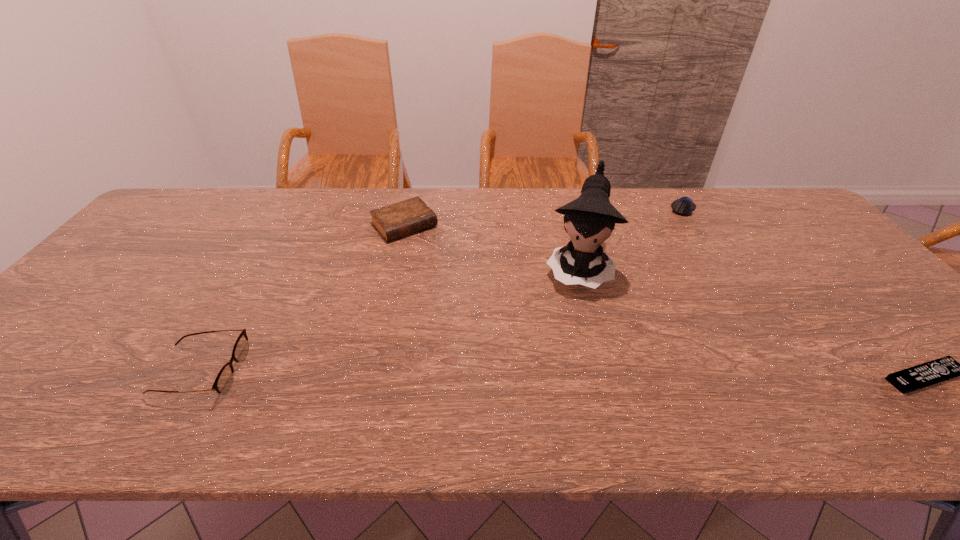
Where is `object that ranks as the third closest to the diary`? The image size is (960, 540). object that ranks as the third closest to the diary is located at coordinates (684, 206).

The image size is (960, 540). What are the coordinates of `free spot that satisfies the following two spatial constraints: 1. on the back side of the second object from right to left; 2. on the right side of the third shortest object` in the screenshot? It's located at (408, 208).

The height and width of the screenshot is (540, 960). In order to click on vacant position in the image that satisfies the following two spatial constraints: 1. on the back side of the third shortest object; 2. on the right side of the second shortest object in this screenshot , I will do `click(408, 208)`.